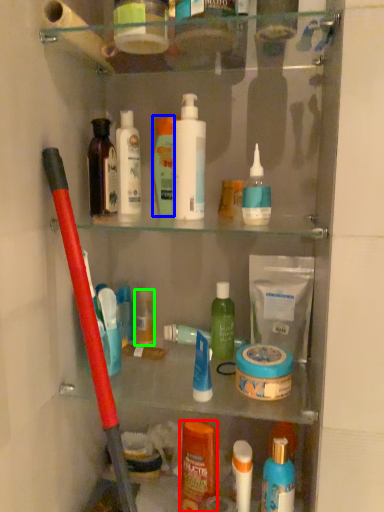
Question: Estimate the real-world distances between objects in this image. Which object is farther from toiletry (highlighted by a red box), toiletry (highlighted by a blue box) or toiletry (highlighted by a green box)?

Choices:
 (A) toiletry
 (B) toiletry

Answer: (A)